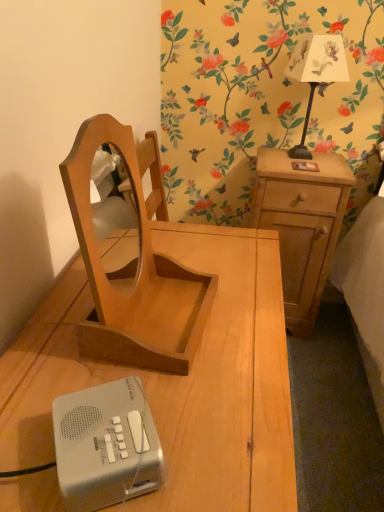
Find the location of a particular element. The width and height of the screenshot is (384, 512). vacant space behind silver plastic radio at lower left is located at coordinates (129, 362).